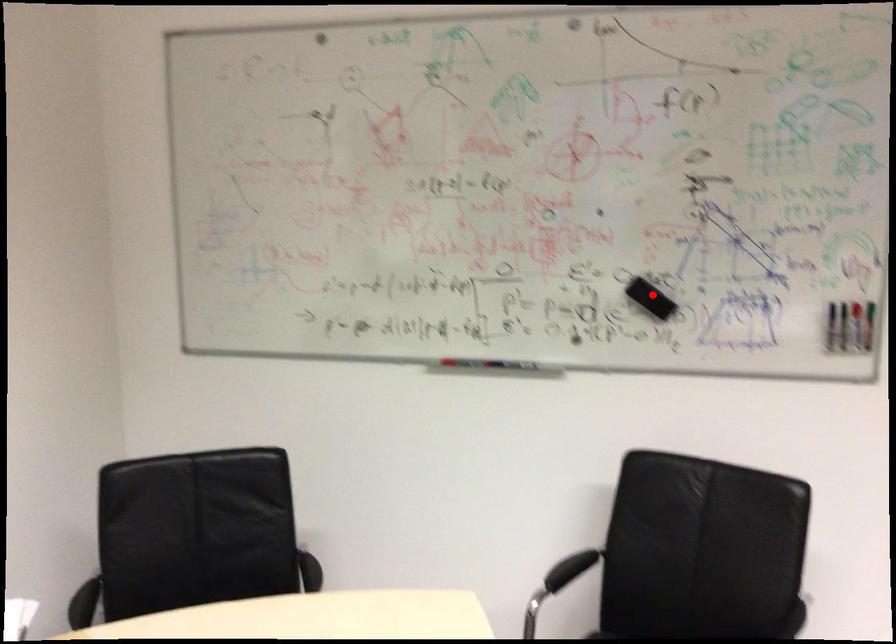
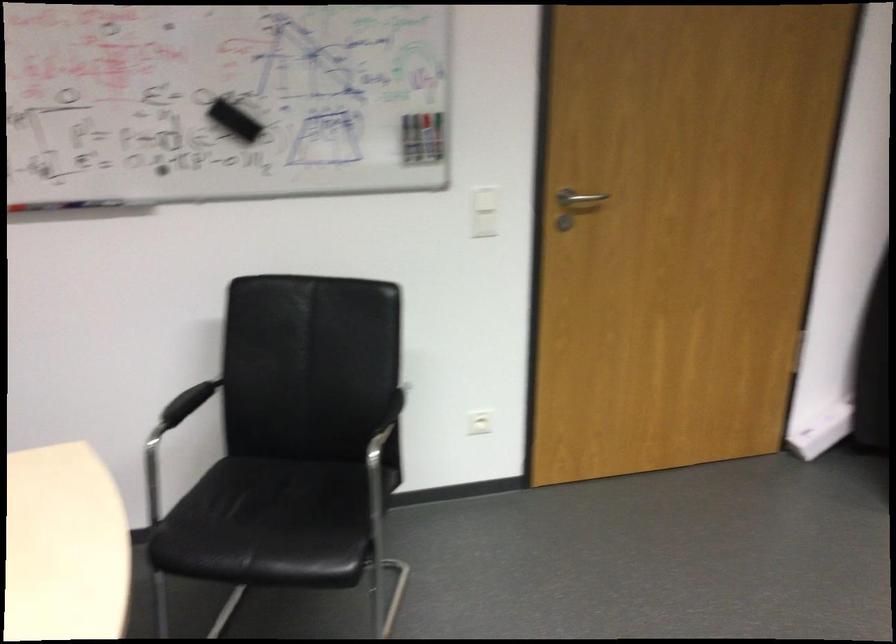
Where in the second image is the point corresponding to the highlighted location from the first image?

(233, 118)